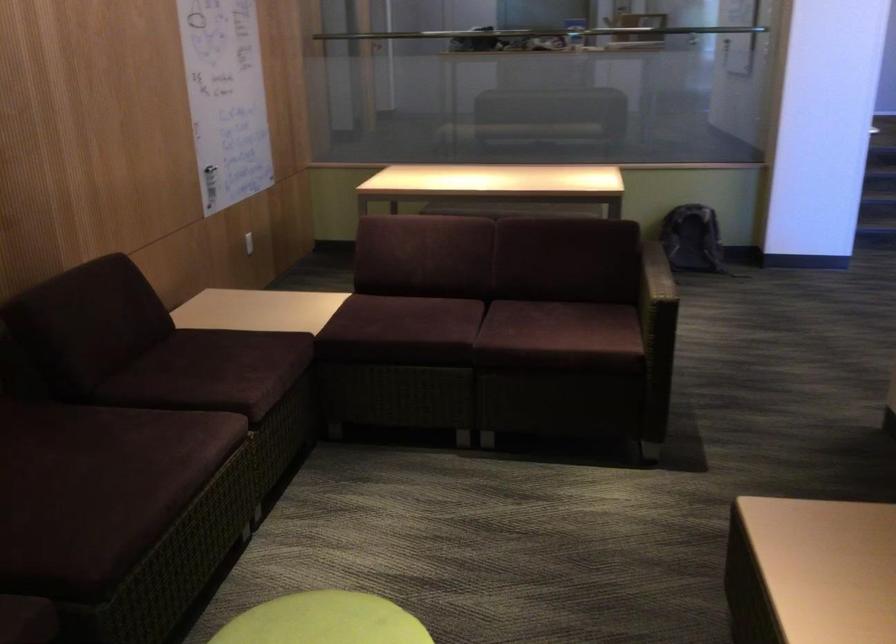
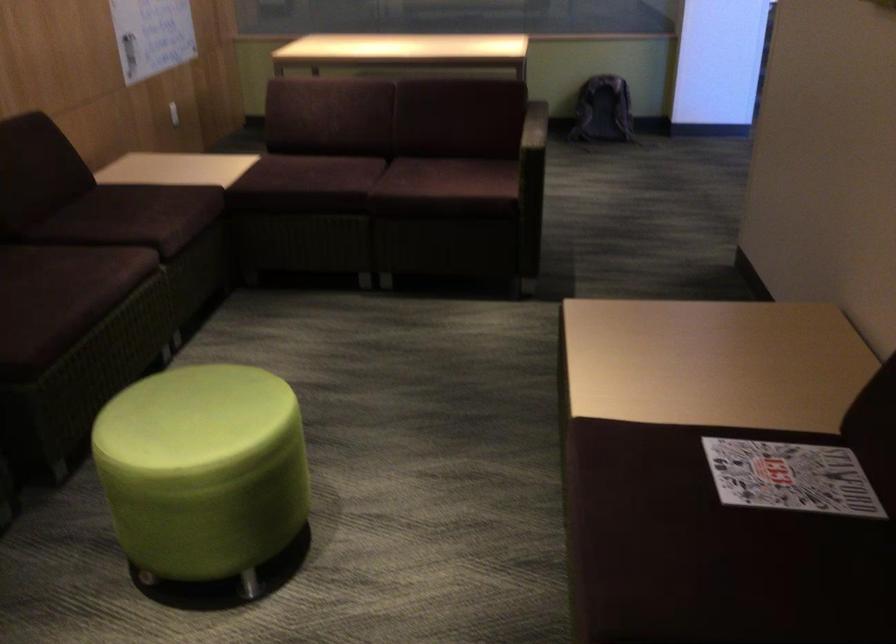
Locate, in the second image, the point that corresponds to point (231, 375) in the first image.

(147, 214)